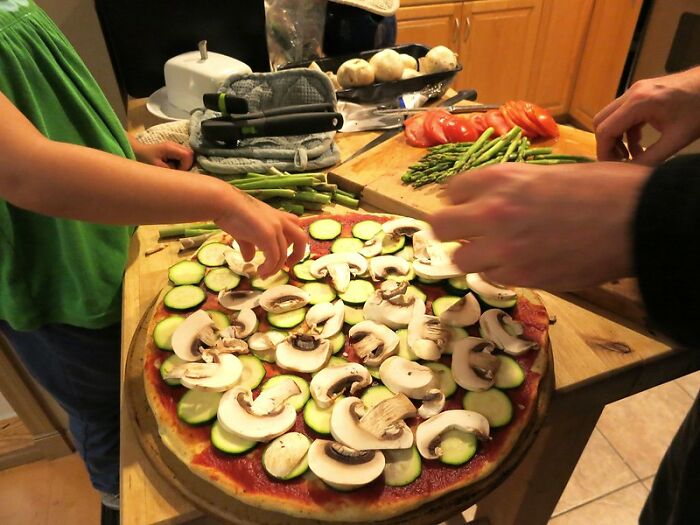
At what (x,y) coordinates should I click in order to perform the action: click on wooden pizza pan. Please return your answer as a coordinate pair (x, y). The image size is (700, 525). Looking at the image, I should click on (180, 478).